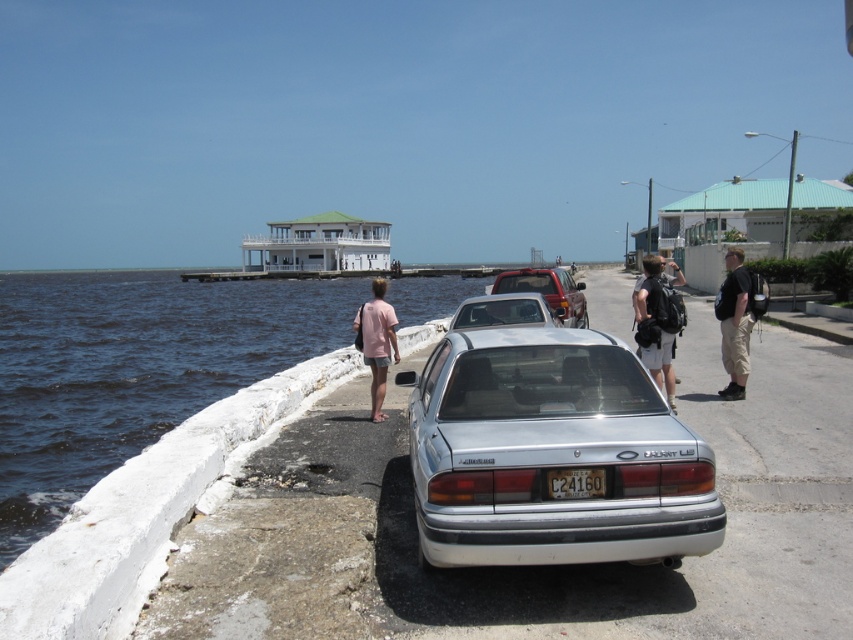
Question: Can you confirm if matte black backpack at center is positioned to the left of pink cotton shirt at center?

Choices:
 (A) yes
 (B) no

Answer: (B)

Question: Estimate the real-world distances between objects in this image. Which object is farther from the black backpack at right?

Choices:
 (A) white plastic license plate at center
 (B) metallic silver pickup truck at center
 (C) matte black backpack at center
 (D) pink cotton shirt at center

Answer: (D)

Question: Which object is the farthest from the white plastic license plate at center?

Choices:
 (A) matte black backpack at center
 (B) black backpack at right
 (C) pink cotton shirt at center
 (D) silver metallic sedan at center

Answer: (B)

Question: Is matte black backpack at center bigger than black backpack at right?

Choices:
 (A) yes
 (B) no

Answer: (A)

Question: Is black backpack at right bigger than pink cotton shirt at center?

Choices:
 (A) no
 (B) yes

Answer: (A)

Question: Which object appears farthest from the camera in this image?

Choices:
 (A) white plastic license plate at center
 (B) matte black backpack at center

Answer: (B)